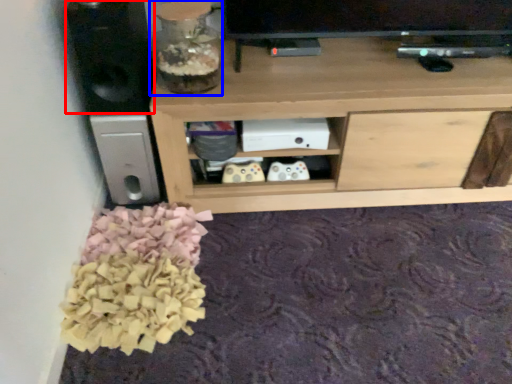
Question: Which object appears closest to the camera in this image, speaker (highlighted by a red box) or glass vase (highlighted by a blue box)?

Choices:
 (A) speaker
 (B) glass vase

Answer: (A)